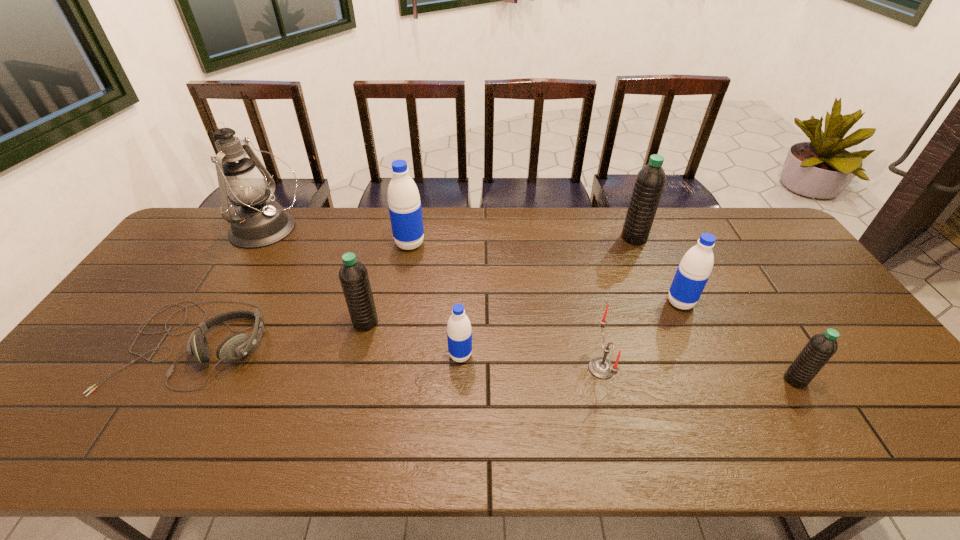
This screenshot has height=540, width=960. I want to click on object located in the far left corner section of the desktop, so click(x=258, y=222).

Identify the location of free space at the far edge of the desktop. (462, 242).

I want to click on free region at the far left corner, so click(x=216, y=239).

The image size is (960, 540). Find the location of `vacant space at the near left corner of the desktop`. vacant space at the near left corner of the desktop is located at coordinates (92, 440).

The width and height of the screenshot is (960, 540). What are the coordinates of `free space at the far right corner of the desktop` in the screenshot? It's located at (747, 234).

What are the coordinates of `empty space between the red candle and the biggest black water bottle` in the screenshot? It's located at (617, 303).

Locate an element on the screen. The image size is (960, 540). blank region between the second smallest black water bottle and the fifth object from right to left is located at coordinates pyautogui.click(x=413, y=339).

Locate an element on the screen. vacant space in between the farthest blue water bottle and the rightmost object is located at coordinates pos(603,312).

At what (x,y) coordinates should I click in order to perform the action: click on vacant space that is in between the biggest black water bottle and the smallest black water bottle. Please return your answer as a coordinate pair (x, y). Looking at the image, I should click on (714, 309).

The width and height of the screenshot is (960, 540). I want to click on empty location between the oil lamp and the shortest object, so click(x=230, y=287).